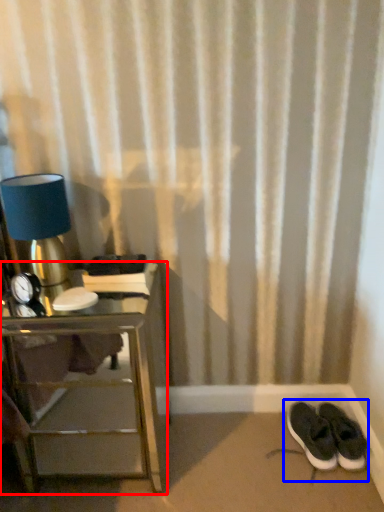
Question: Among these objects, which one is farthest to the camera, nightstand (highlighted by a red box) or footwear (highlighted by a blue box)?

Choices:
 (A) nightstand
 (B) footwear

Answer: (B)